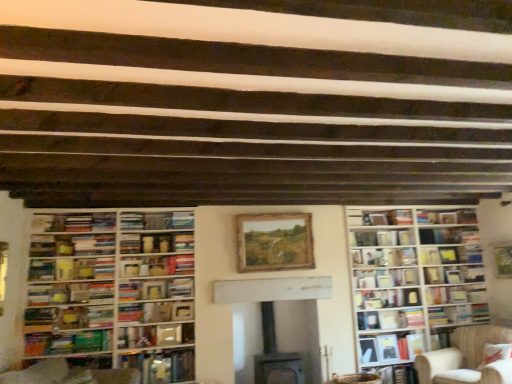
I want to click on free space above hardcover book at left, which is counted as the eleventh book, starting from the bottom (from a real-world perspective), so click(91, 213).